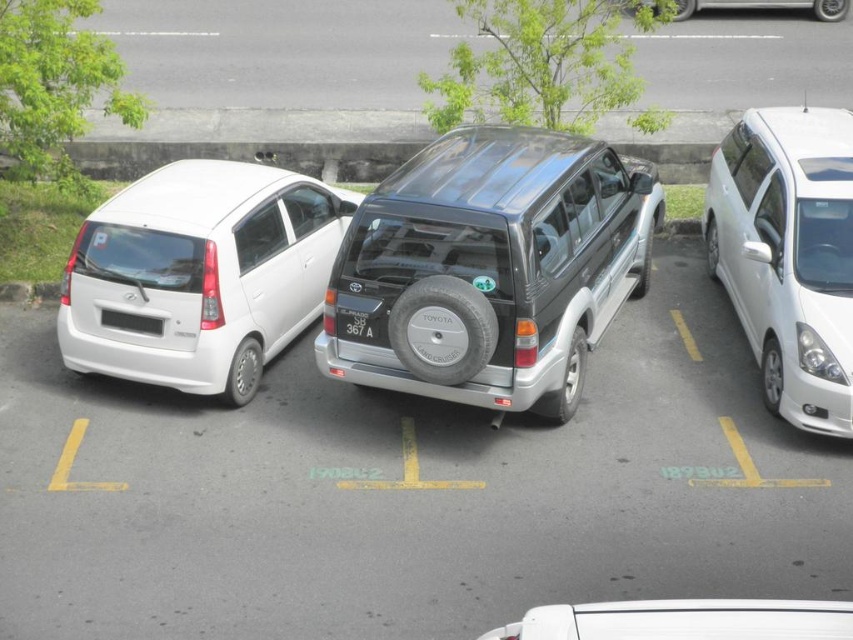
You are a delivery person trying to park your van in the parking lot. You see the white glossy minivan at right and the metallic silver car at upper right. Which vehicle is closer to the left side of the parking lot?

The white glossy minivan at right is positioned on the left side of metallic silver car at upper right, so it is closer to the left side of the parking lot.

You are a delivery person trying to park your van in the parking lot. The van requires a space that is at least 6 meters long. Based on the distance between the metallic silver car at upper right and the black plastic license plate at rear, can you determine if the parking space between them is sufficient for your van?

The distance between the metallic silver car at upper right and the black plastic license plate at rear is 7.46 meters, which is longer than the required 6 meters. Therefore, the parking space between them is sufficient for your van.

You are standing at the entrance of the parking lot and want to locate the metallic silver car at upper right. According to the coordinate system where the bottom left corner is the origin, can you tell me its position?

The metallic silver car at upper right is located at point (766, 6).